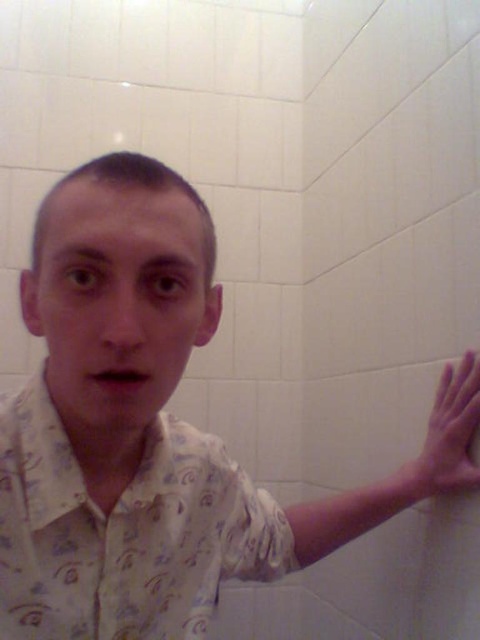
You are trying to locate the white printed shirt at center in a dimly lit bathroom with white tiles. Based on the coordinates provided, where exactly is the shirt positioned in the image?

The white printed shirt at center is located at point (124, 532), which means it is positioned towards the right side and slightly above the lower middle of the image.